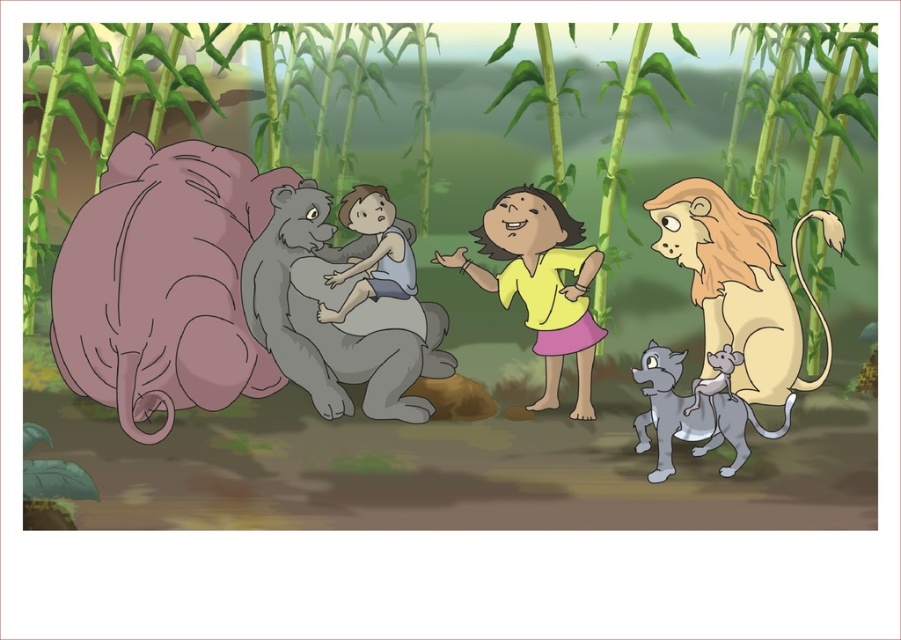
Question: Does green bamboo at center have a greater width compared to yellow matte shirt at center?

Choices:
 (A) no
 (B) yes

Answer: (B)

Question: Does yellow matte shirt at center come in front of smooth gray fur at center?

Choices:
 (A) yes
 (B) no

Answer: (A)

Question: Which is nearer to the light brown fur monkey at right?

Choices:
 (A) gray furry cat at lower right
 (B) smooth gray fur at center

Answer: (A)

Question: Which of these objects is positioned farthest from the gray furry cat at lower right?

Choices:
 (A) matte pink hippo at left
 (B) light brown fur monkey at right

Answer: (A)

Question: Is green bamboo at center closer to camera compared to yellow matte shirt at center?

Choices:
 (A) yes
 (B) no

Answer: (B)

Question: Which object appears closest to the camera in this image?

Choices:
 (A) yellow matte shirt at center
 (B) green bamboo at center

Answer: (A)